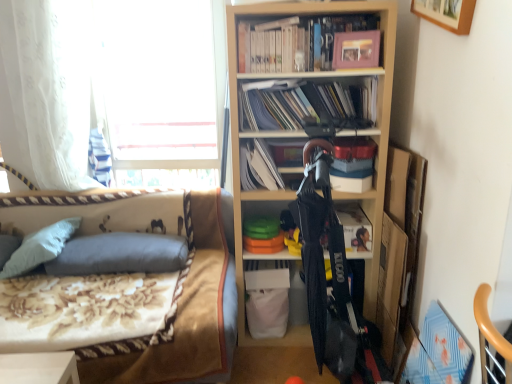
Question: Is point (241, 160) positioned closer to the camera than point (46, 185)?

Choices:
 (A) farther
 (B) closer

Answer: (B)

Question: Visually, is white paper at center, which ranks as the 2th book in bottom-to-top order, positioned to the left or to the right of white sheer curtain at left?

Choices:
 (A) left
 (B) right

Answer: (B)

Question: Which object is positioned farthest from the white paper at center, the third book in the top-to-bottom sequence?

Choices:
 (A) gray fabric pillow at left, the 2th pillow from the left
 (B) matte black book at center, acting as the fourth book starting from the top
 (C) matte pink photo album at upper center, positioned as the 4th book in bottom-to-top order
 (D) floral fabric bed at left
 (E) pink matte picture frame at upper center, arranged as the second picture frame when viewed from the right

Answer: (A)

Question: Which is nearer to the floral fabric bed at left?

Choices:
 (A) gray fabric pillow at left, which ranks as the 1th pillow in left-to-right order
 (B) pink matte picture frame at upper center, the first picture frame viewed from the back
 (C) matte pink photo album at upper center, marked as the first book in a top-to-bottom arrangement
 (D) wooden picture frame at upper right, which ranks as the second picture frame in back-to-front order
 (E) matte black book at center, which ranks as the 1th book in bottom-to-top order

Answer: (A)